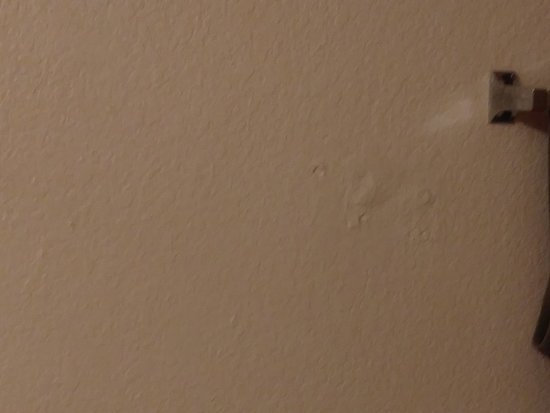
Locate an element on the screen. The image size is (550, 413). filled in screw holes is located at coordinates (317, 171), (426, 197).